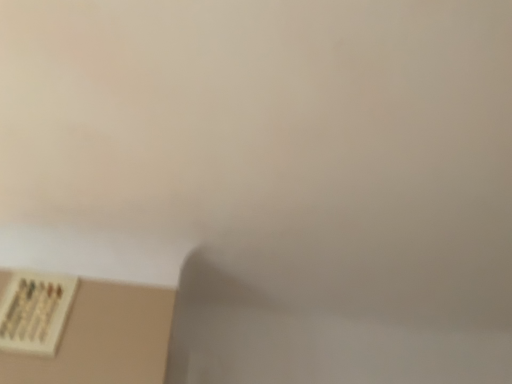
What do you see at coordinates (35, 312) in the screenshot?
I see `white plastic power plugs and sockets at lower left` at bounding box center [35, 312].

Locate an element on the screen. The height and width of the screenshot is (384, 512). white plastic power plugs and sockets at lower left is located at coordinates (35, 312).

Locate an element on the screen. This screenshot has height=384, width=512. white plastic power plugs and sockets at lower left is located at coordinates (35, 312).